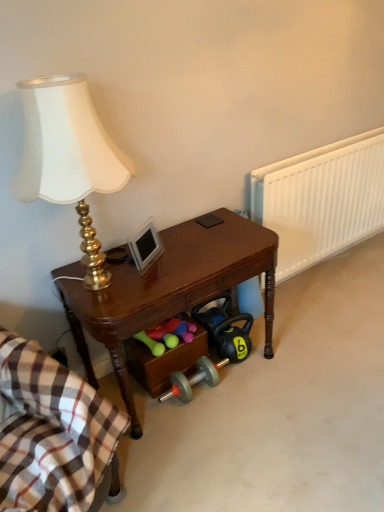
Question: Is plaid cotton blanket at lower left placed right next to white plastic radiator at right?

Choices:
 (A) no
 (B) yes

Answer: (A)

Question: Does plaid cotton blanket at lower left have a larger size compared to white plastic radiator at right?

Choices:
 (A) yes
 (B) no

Answer: (A)

Question: From the image's perspective, is plaid cotton blanket at lower left over white plastic radiator at right?

Choices:
 (A) yes
 (B) no

Answer: (B)

Question: Considering the relative positions of plaid cotton blanket at lower left and white plastic radiator at right in the image provided, is plaid cotton blanket at lower left to the right of white plastic radiator at right from the viewer's perspective?

Choices:
 (A) no
 (B) yes

Answer: (A)

Question: Considering the relative sizes of plaid cotton blanket at lower left and white plastic radiator at right in the image provided, is plaid cotton blanket at lower left taller than white plastic radiator at right?

Choices:
 (A) no
 (B) yes

Answer: (B)

Question: Looking at their shapes, would you say shiny brown desk at center is wider or thinner than gold metallic lamp at left?

Choices:
 (A) wide
 (B) thin

Answer: (A)

Question: Considering their positions, is shiny brown desk at center located in front of or behind gold metallic lamp at left?

Choices:
 (A) front
 (B) behind

Answer: (B)

Question: From a real-world perspective, relative to gold metallic lamp at left, is shiny brown desk at center vertically above or below?

Choices:
 (A) above
 (B) below

Answer: (B)

Question: Is shiny brown desk at center inside or outside of gold metallic lamp at left?

Choices:
 (A) outside
 (B) inside

Answer: (A)

Question: Visually, is plaid cotton blanket at lower left positioned to the left or to the right of white plastic radiator at right?

Choices:
 (A) right
 (B) left

Answer: (B)

Question: Is plaid cotton blanket at lower left inside or outside of white plastic radiator at right?

Choices:
 (A) outside
 (B) inside

Answer: (A)

Question: From their relative heights in the image, would you say plaid cotton blanket at lower left is taller or shorter than white plastic radiator at right?

Choices:
 (A) short
 (B) tall

Answer: (B)

Question: From the image's perspective, is plaid cotton blanket at lower left located above or below white plastic radiator at right?

Choices:
 (A) below
 (B) above

Answer: (A)

Question: Looking at their shapes, would you say plaid cotton blanket at lower left is wider or thinner than shiny brown desk at center?

Choices:
 (A) thin
 (B) wide

Answer: (B)

Question: Considering the positions of plaid cotton blanket at lower left and shiny brown desk at center in the image, is plaid cotton blanket at lower left bigger or smaller than shiny brown desk at center?

Choices:
 (A) small
 (B) big

Answer: (B)